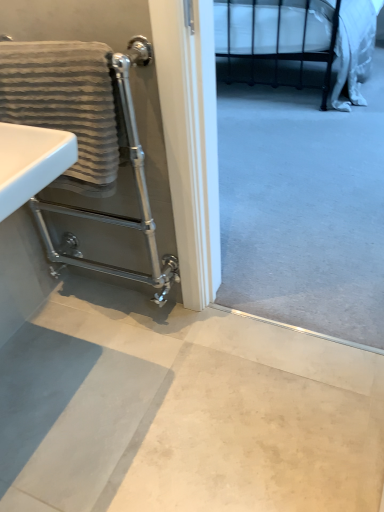
Question: Is silver metallic towel rack at left located within smooth concrete floor at lower center?

Choices:
 (A) no
 (B) yes

Answer: (A)

Question: From a real-world perspective, is smooth concrete floor at lower center positioned over silver metallic towel rack at left based on gravity?

Choices:
 (A) no
 (B) yes

Answer: (A)

Question: Is smooth concrete floor at lower center not near silver metallic towel rack at left?

Choices:
 (A) yes
 (B) no

Answer: (B)

Question: Is smooth concrete floor at lower center turned away from silver metallic towel rack at left?

Choices:
 (A) no
 (B) yes

Answer: (A)

Question: Can you confirm if smooth concrete floor at lower center is taller than silver metallic towel rack at left?

Choices:
 (A) yes
 (B) no

Answer: (B)

Question: From the image's perspective, relative to smooth concrete floor at lower center, is black metal bed at upper right above or below?

Choices:
 (A) above
 (B) below

Answer: (A)

Question: Looking at the image, does black metal bed at upper right seem bigger or smaller compared to smooth concrete floor at lower center?

Choices:
 (A) small
 (B) big

Answer: (B)

Question: From a real-world perspective, is black metal bed at upper right above or below smooth concrete floor at lower center?

Choices:
 (A) below
 (B) above

Answer: (B)

Question: Would you say black metal bed at upper right is to the left or to the right of smooth concrete floor at lower center in the picture?

Choices:
 (A) left
 (B) right

Answer: (B)

Question: From the image's perspective, is silver metallic towel rack at left above or below black metal bed at upper right?

Choices:
 (A) below
 (B) above

Answer: (A)

Question: Is point (82, 19) closer or farther from the camera than point (276, 14)?

Choices:
 (A) farther
 (B) closer

Answer: (B)

Question: From a real-world perspective, is silver metallic towel rack at left above or below black metal bed at upper right?

Choices:
 (A) below
 (B) above

Answer: (B)

Question: Is silver metallic towel rack at left taller or shorter than black metal bed at upper right?

Choices:
 (A) tall
 (B) short

Answer: (A)

Question: From the image's perspective, is silver metallic towel rack at left positioned above or below gray textured towel at left?

Choices:
 (A) below
 (B) above

Answer: (A)

Question: Looking at the image, does silver metallic towel rack at left seem bigger or smaller compared to gray textured towel at left?

Choices:
 (A) small
 (B) big

Answer: (B)